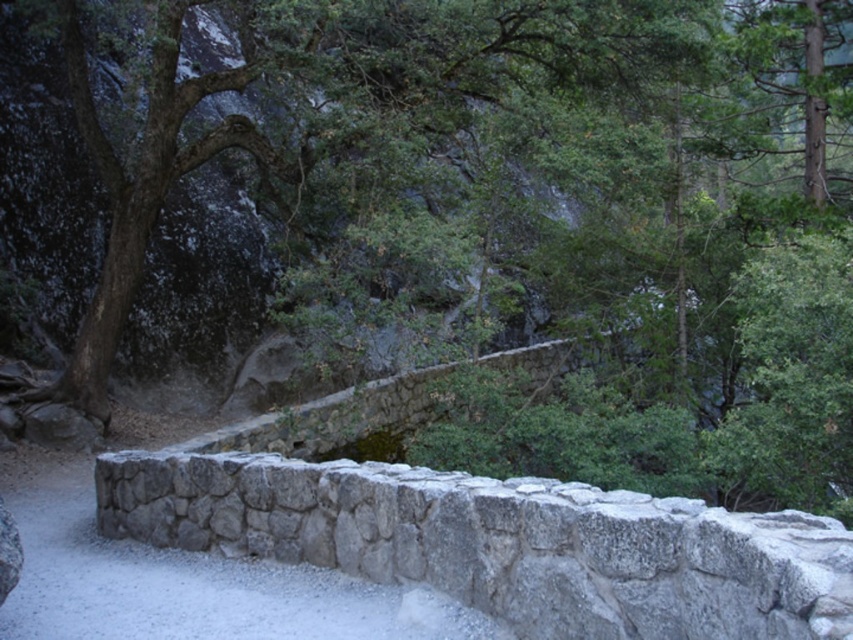
Is point (660, 636) less distant than point (236, 572)?

Yes, point (660, 636) is in front of point (236, 572).

Is gray stone wall at lower center positioned in front of gray stone wall at center?

That is True.

I want to click on gray stone wall at lower center, so click(500, 544).

Find the location of a particular element. gray stone wall at lower center is located at coordinates (500, 544).